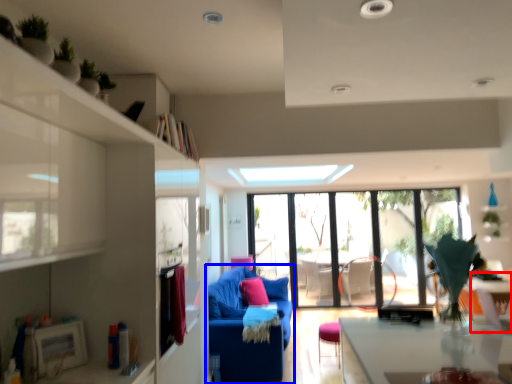
Question: Among these objects, which one is nearest to the camera, table (highlighted by a red box) or studio couch (highlighted by a blue box)?

Choices:
 (A) table
 (B) studio couch

Answer: (A)